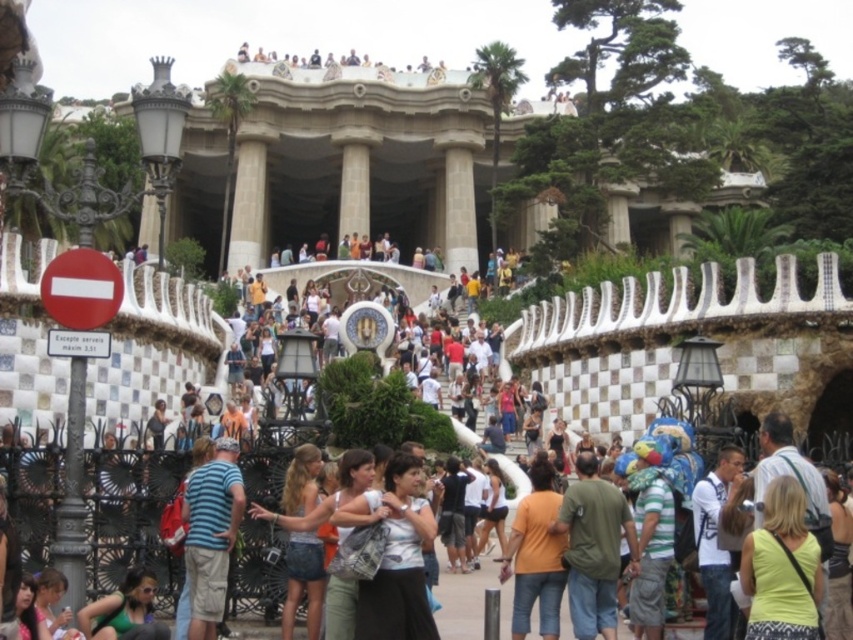
Consider the image. Who is higher up, white cotton shirt at center or matte black hair at lower left?

Positioned higher is matte black hair at lower left.

Does white cotton shirt at center appear on the left side of matte black hair at lower left?

In fact, white cotton shirt at center is to the right of matte black hair at lower left.

Find the location of a particular element. The height and width of the screenshot is (640, 853). white cotton shirt at center is located at coordinates (393, 554).

Does white cotton shirt at center have a lesser height compared to orange matte shirt at center?

Correct, white cotton shirt at center is not as tall as orange matte shirt at center.

Consider the image. Does white cotton shirt at center lie in front of orange matte shirt at center?

Yes, white cotton shirt at center is in front of orange matte shirt at center.

Does point (419, 552) lie in front of point (548, 525)?

Yes, point (419, 552) is in front of point (548, 525).

At what (x,y) coordinates should I click in order to perform the action: click on white cotton shirt at center. Please return your answer as a coordinate pair (x, y). This screenshot has width=853, height=640. Looking at the image, I should click on (393, 554).

Who is taller, orange matte shirt at center or matte black hair at lower left?

orange matte shirt at center

What do you see at coordinates (537, 554) in the screenshot? The height and width of the screenshot is (640, 853). I see `orange matte shirt at center` at bounding box center [537, 554].

Is point (520, 609) farther from viewer compared to point (45, 632)?

Yes, point (520, 609) is behind point (45, 632).

Locate an element on the screen. This screenshot has width=853, height=640. orange matte shirt at center is located at coordinates (537, 554).